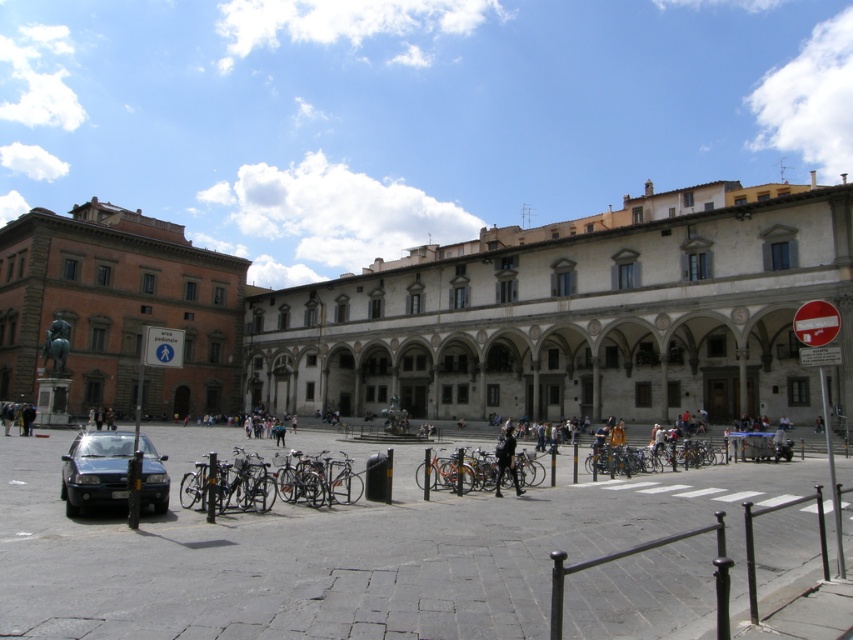
You are a tourist standing in the urban square and want to take a photo of the dark blue uniform at center without including the orange matte bicycle at center in the frame. Which direction should you move to achieve this?

The orange matte bicycle at center is positioned on the left side of dark blue uniform at center. To exclude the orange matte bicycle at center from the photo, you should move to the right side of the dark blue uniform at center.

You are a tourist standing in the urban square and want to take a photo of the matte stone building at center without the shiny black sedan at lower left blocking the view. Is the sedan positioned in front of or behind the building?

The matte stone building at center is in front of the shiny black sedan at lower left, so the sedan is behind the building and won

You are standing at the center of the urban square and see two points marked in the image. Which point, point (523, 451) or point (509, 429), is closer to you?

Point (523, 451) is in front of point (509, 429), so it is closer to you.